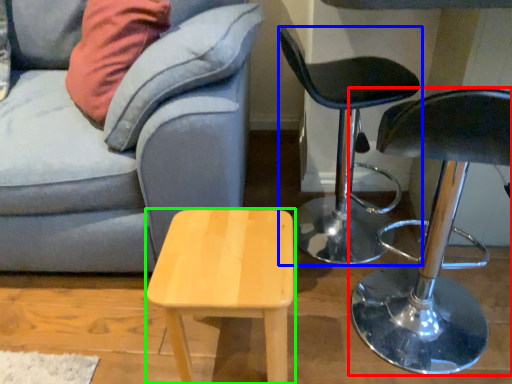
Question: Considering the real-world distances, which object is farthest from chair (highlighted by a red box)? chair (highlighted by a blue box) or stool (highlighted by a green box)?

Choices:
 (A) chair
 (B) stool

Answer: (B)